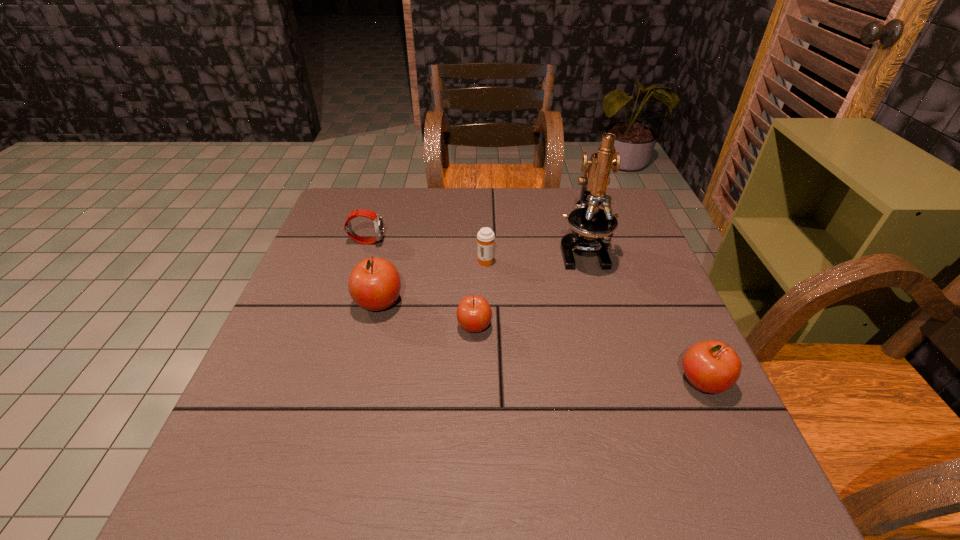
The height and width of the screenshot is (540, 960). What are the coordinates of `object at the far right corner` in the screenshot? It's located at (588, 222).

Identify the location of free space at the far edge of the desktop. (470, 219).

The image size is (960, 540). What are the coordinates of `free space at the near edge` in the screenshot? It's located at (528, 436).

The width and height of the screenshot is (960, 540). I want to click on vacant space at the left edge, so click(x=344, y=245).

Locate an element on the screen. The image size is (960, 540). free space at the right edge of the desktop is located at coordinates (664, 357).

What are the coordinates of `vacant space at the far left corner` in the screenshot? It's located at (372, 222).

The image size is (960, 540). Identify the location of blank region between the watch and the second object from right to left. (474, 246).

You are a GUI agent. You are given a task and a screenshot of the screen. Output one action in this format:
    pyautogui.click(x=<x>, y=<y>)
    Task: Click on the free space between the second object from right to left and the shortest apple
    Image resolution: width=960 pixels, height=540 pixels.
    Given the screenshot: What is the action you would take?
    pyautogui.click(x=528, y=288)

Find the location of a particular element. The width and height of the screenshot is (960, 540). empty space between the third tallest object and the second apple from right to left is located at coordinates (588, 354).

Find the location of `empty space between the watch and the medicine`. empty space between the watch and the medicine is located at coordinates (426, 251).